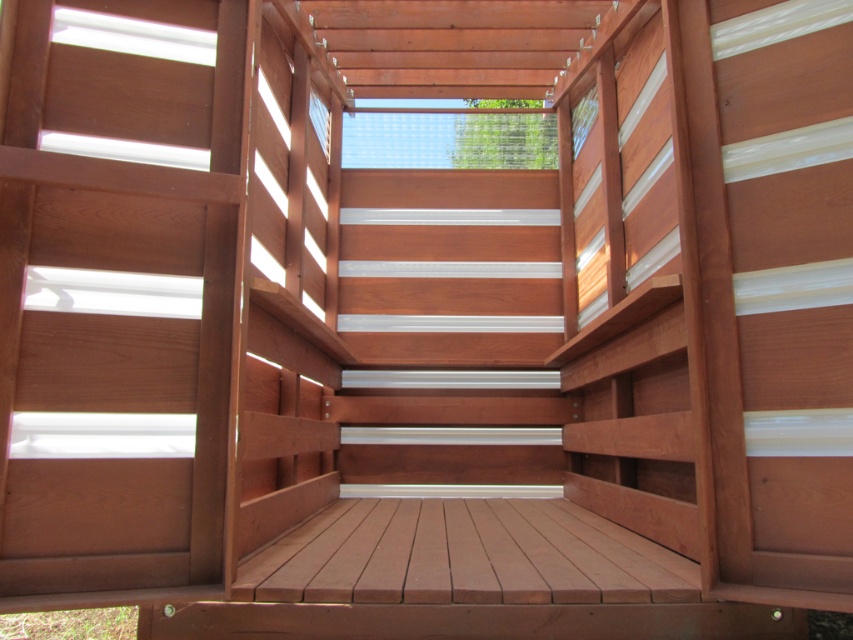
Question: Which point is farther to the camera?

Choices:
 (A) (543, 458)
 (B) (67, 244)

Answer: (A)

Question: Which of the following is the closest to the observer?

Choices:
 (A) (3, 600)
 (B) (553, 291)

Answer: (A)

Question: Does satin wood stair at left have a larger size compared to white smooth stair at center?

Choices:
 (A) yes
 (B) no

Answer: (B)

Question: Is satin wood stair at left wider than white smooth stair at center?

Choices:
 (A) yes
 (B) no

Answer: (B)

Question: Does satin wood stair at left appear on the left side of white smooth stair at center?

Choices:
 (A) no
 (B) yes

Answer: (B)